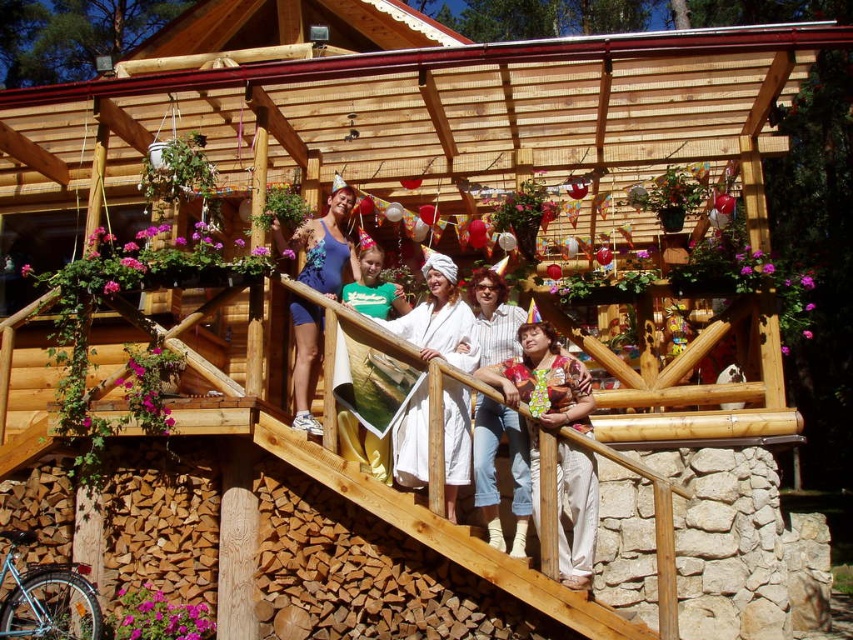
Is point (289, 305) closer to camera compared to point (370, 257)?

Yes, it is.

Which is below, blue fabric swimsuit at upper center or green cotton shirt at center?

blue fabric swimsuit at upper center

Is point (300, 241) farther from viewer compared to point (372, 259)?

Yes, point (300, 241) is farther from viewer.

This screenshot has height=640, width=853. I want to click on blue fabric swimsuit at upper center, so click(323, 243).

Does point (399, 461) come farther from viewer compared to point (325, 220)?

No, (399, 461) is closer to viewer.

Does white cotton bathrobe at center have a greater height compared to blue fabric swimsuit at upper center?

In fact, white cotton bathrobe at center may be shorter than blue fabric swimsuit at upper center.

What do you see at coordinates (440, 317) in the screenshot? I see `white cotton bathrobe at center` at bounding box center [440, 317].

The height and width of the screenshot is (640, 853). I want to click on white cotton bathrobe at center, so click(440, 317).

Who is more distant from viewer, [453,513] or [363,305]?

The point [363,305] is more distant.

Is point (422, 384) positioned in front of point (374, 308)?

That is True.

This screenshot has width=853, height=640. What are the coordinates of `white cotton bathrobe at center` in the screenshot? It's located at (440, 317).